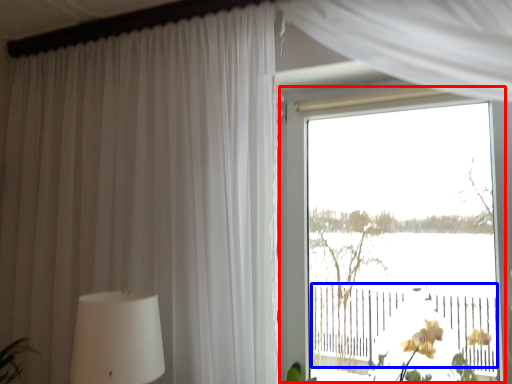
Question: Which object is closer to the camera taking this photo, window (highlighted by a red box) or rail (highlighted by a blue box)?

Choices:
 (A) window
 (B) rail

Answer: (B)